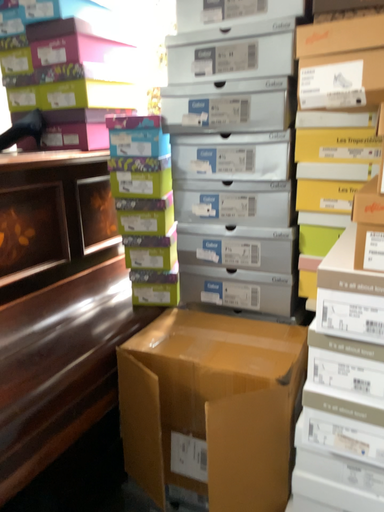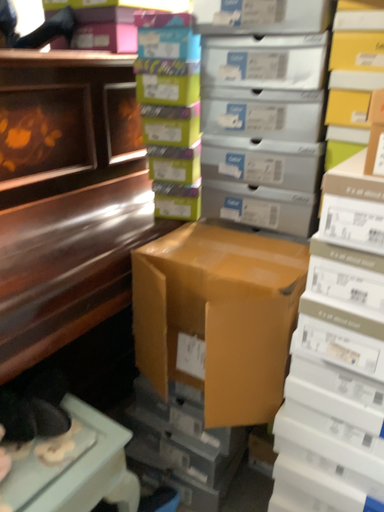
Question: Which way did the camera rotate in the video?

Choices:
 (A) rotated left
 (B) rotated right

Answer: (A)